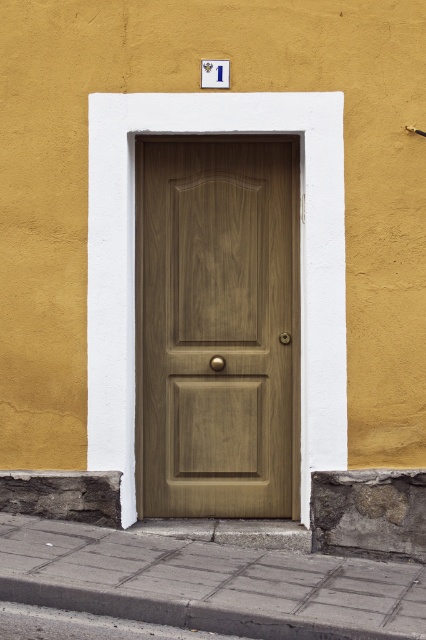
Can you confirm if wooden door at center is smaller than gray concrete pavement at lower center?

Yes.

Is wooden door at center above gray concrete pavement at lower center?

Correct, wooden door at center is located above gray concrete pavement at lower center.

Is point (276, 237) behind point (46, 604)?

Yes, it is.

Where is `wooden door at center`? wooden door at center is located at coordinates (218, 326).